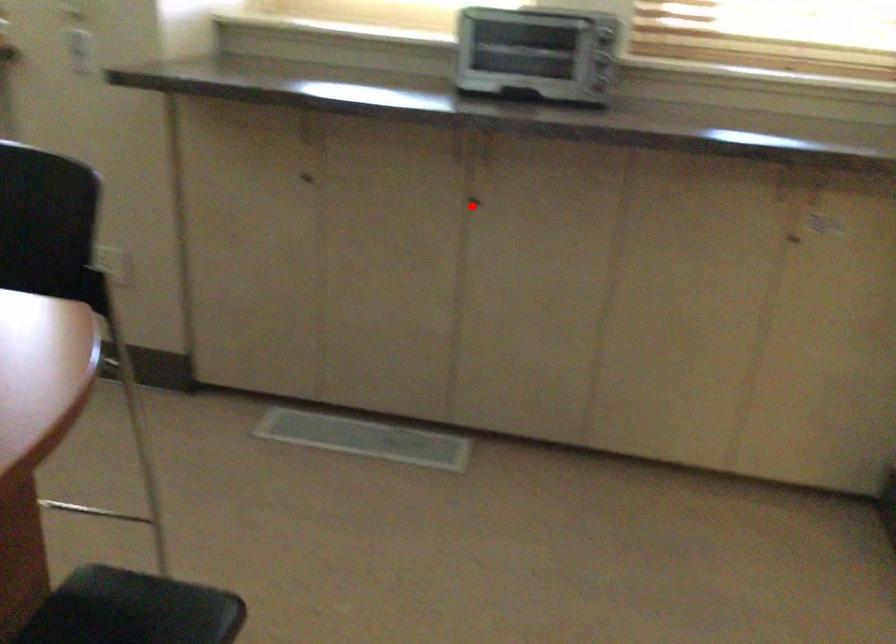
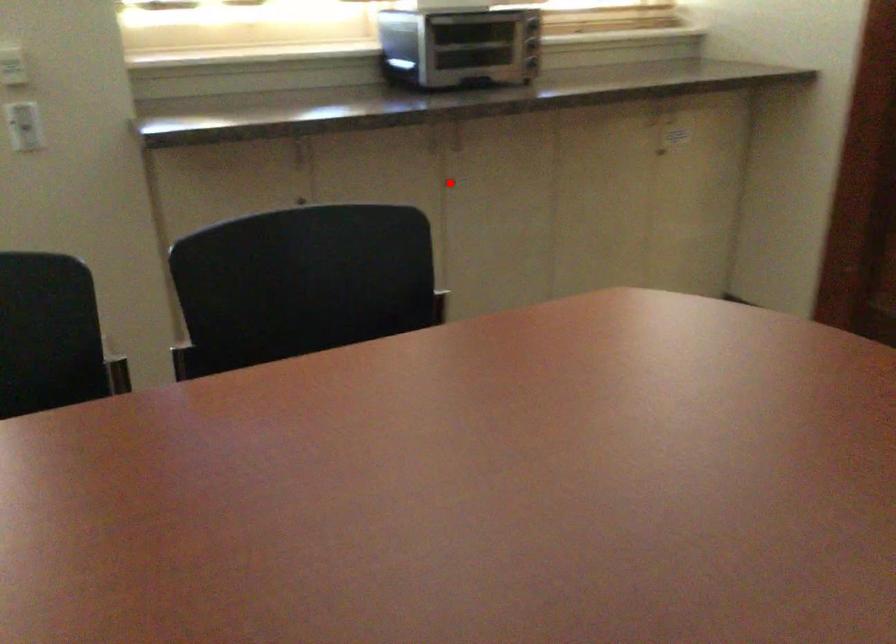
I am providing you with two images of the same scene from different viewpoints. A red point is marked on the first image and another point is marked on the second image. Is the marked point in image1 the same physical position as the marked point in image2?

Yes